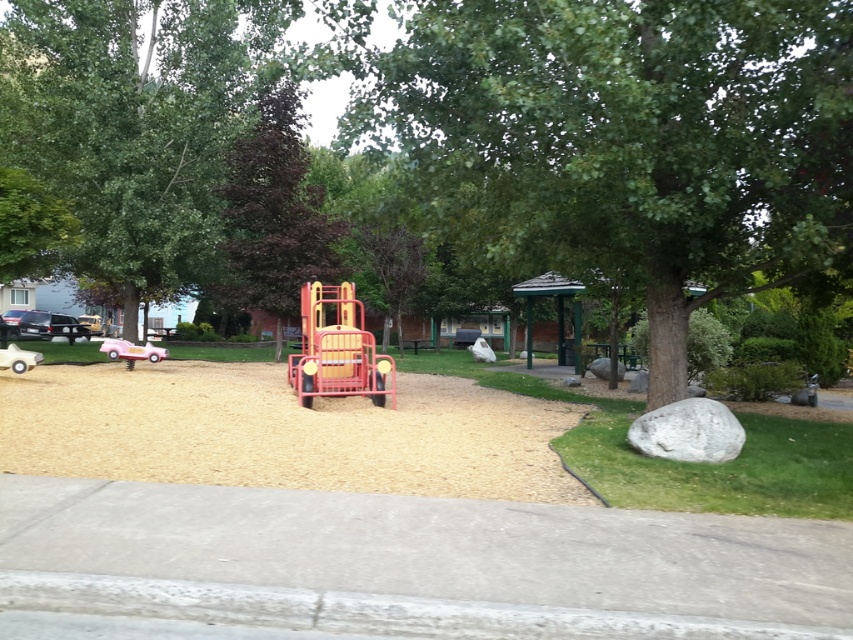
Can you confirm if dark green leafy tree at center is smaller than white rubber car at lower left?

Actually, dark green leafy tree at center might be larger than white rubber car at lower left.

Which is in front, point (263, 234) or point (13, 349)?

Point (13, 349)

You are a GUI agent. You are given a task and a screenshot of the screen. Output one action in this format:
    pyautogui.click(x=<x>, y=<y>)
    Task: Click on the dark green leafy tree at center
    
    Given the screenshot: What is the action you would take?
    pyautogui.click(x=271, y=214)

Which is more to the left, green leafy tree at center or dark green leafy tree at center?

dark green leafy tree at center is more to the left.

Is point (573, 189) in front of point (294, 188)?

Yes, point (573, 189) is in front of point (294, 188).

This screenshot has width=853, height=640. Find the location of `green leafy tree at center`. green leafy tree at center is located at coordinates (614, 138).

The image size is (853, 640). Describe the element at coordinates (337, 348) in the screenshot. I see `metallic red play truck at center` at that location.

Who is shorter, metallic red play truck at center or white rubber car at lower left?

white rubber car at lower left

You are a GUI agent. You are given a task and a screenshot of the screen. Output one action in this format:
    pyautogui.click(x=<x>, y=<y>)
    Task: Click on the metallic red play truck at center
    
    Given the screenshot: What is the action you would take?
    pyautogui.click(x=337, y=348)